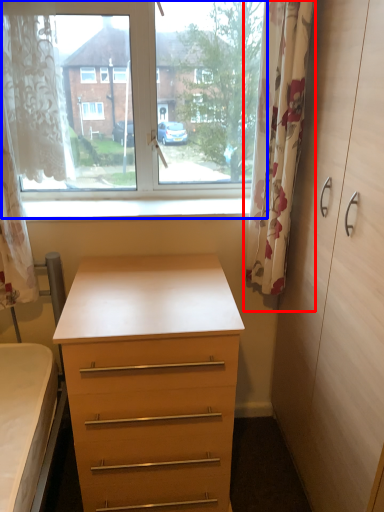
Question: Which object appears closest to the camera in this image, curtain (highlighted by a red box) or window (highlighted by a blue box)?

Choices:
 (A) curtain
 (B) window

Answer: (A)